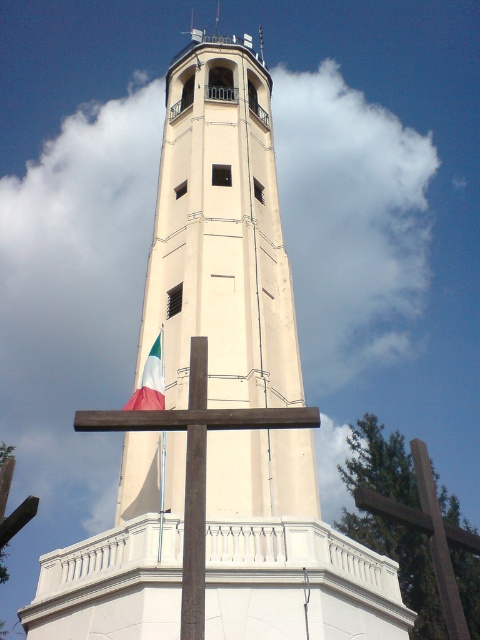
You are a photographer planning to capture the brown wooden cross at center and the white fabric flag at center in a single shot. Based on their positions, which object will appear closer to the bottom of your photo?

The brown wooden cross at center is below the white fabric flag at center, so it will appear closer to the bottom of the photo.

You are standing in front of the tower and want to take a photo of the brown wooden cross at center and the white fabric flag at center. Which object will appear closer to you in the photo?

The brown wooden cross at center is in front of white fabric flag at center, so it will appear closer in the photo.

Consider the image. You are an event planner setting up decorations for a ceremony. You have the brown wooden cross at center and the white fabric flag at center. Which object should you place on the left side of the stage if you want the wider object to be on the right side?

The brown wooden cross at center is wider than the white fabric flag at center. To place the wider object on the right side, you should put the brown wooden cross at center on the right and the white fabric flag at center on the left.